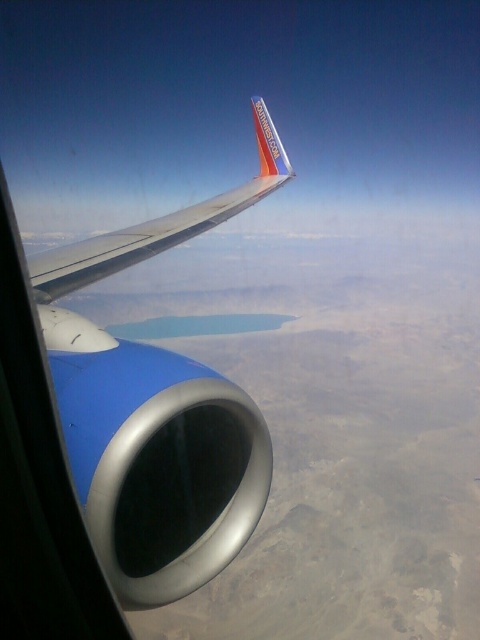
You are a passenger sitting in the airplane and looking out the window. You see the metallic blue engine at center and the metallic silver wing at center. Which object is positioned lower in your field of view?

The metallic blue engine at center is located below the metallic silver wing at center, so it is positioned lower in your field of view.

You are a passenger sitting in an airplane seat and want to know how far the point at coordinates point (121, 570) is from your current position. Can you determine the distance?

The point (121, 570) is 4.61 feet from the camera, so the distance from your current position to the point (121, 570) is approximately 4.61 feet.

You are a passenger sitting in the airplane and looking out the window. You notice two points in the scene. The first point is at coordinate point [106,237] and the second is at point [104,248]. Which point is closer to your eyes?

Point [104,248] is closer to your eyes because it is less further to the camera than point [106,237].